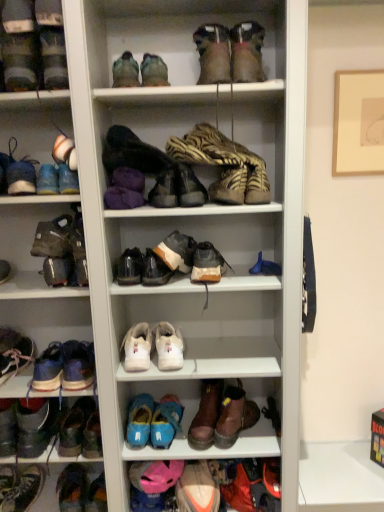
Question: Which direction should I rotate to look at brown leather boot at lower center, which is the seventh shoe from bottom to top?

Choices:
 (A) left
 (B) right

Answer: (B)

Question: Is there a large distance between leather at center, which ranks as the 10th shoe in bottom-to-top order, and white leather sneakers at center, the 8th shoe from the bottom?

Choices:
 (A) yes
 (B) no

Answer: (B)

Question: Can you confirm if leather at center, acting as the ninth shoe starting from the top, is positioned to the left of white leather sneakers at center, the 8th shoe from the bottom?

Choices:
 (A) yes
 (B) no

Answer: (B)

Question: Can we say leather at center, acting as the ninth shoe starting from the top, lies outside white leather sneakers at center, the 8th shoe from the bottom?

Choices:
 (A) yes
 (B) no

Answer: (A)

Question: Considering the relative positions of leather at center, acting as the ninth shoe starting from the top, and white leather sneakers at center, the 8th shoe from the bottom, in the image provided, is leather at center, acting as the ninth shoe starting from the top, to the right of white leather sneakers at center, the 8th shoe from the bottom, from the viewer's perspective?

Choices:
 (A) yes
 (B) no

Answer: (A)

Question: Is leather at center, which ranks as the 10th shoe in bottom-to-top order, bigger than white leather sneakers at center, positioned as the 11th shoe in top-to-bottom order?

Choices:
 (A) no
 (B) yes

Answer: (A)

Question: Considering the relative positions of leather at center, which ranks as the 10th shoe in bottom-to-top order, and white leather sneakers at center, positioned as the 11th shoe in top-to-bottom order, in the image provided, is leather at center, which ranks as the 10th shoe in bottom-to-top order, behind white leather sneakers at center, positioned as the 11th shoe in top-to-bottom order,?

Choices:
 (A) yes
 (B) no

Answer: (B)

Question: Does white matte sneaker at center, which ranks as the 10th shoe in top-to-bottom order, lie in front of multicolored fabric shoe at lower left, positioned as the second shoe in bottom-to-top order?

Choices:
 (A) no
 (B) yes

Answer: (B)

Question: Does white matte sneaker at center, the 9th shoe when ordered from bottom to top, turn towards multicolored fabric shoe at lower left, positioned as the second shoe in bottom-to-top order?

Choices:
 (A) yes
 (B) no

Answer: (B)

Question: Is white matte sneaker at center, which ranks as the 10th shoe in top-to-bottom order, thinner than multicolored fabric shoe at lower left, the 17th shoe viewed from the top?

Choices:
 (A) no
 (B) yes

Answer: (B)

Question: Considering the relative sizes of white matte sneaker at center, which ranks as the 10th shoe in top-to-bottom order, and multicolored fabric shoe at lower left, positioned as the second shoe in bottom-to-top order, in the image provided, is white matte sneaker at center, which ranks as the 10th shoe in top-to-bottom order, shorter than multicolored fabric shoe at lower left, positioned as the second shoe in bottom-to-top order,?

Choices:
 (A) yes
 (B) no

Answer: (A)

Question: Is white matte sneaker at center, which ranks as the 10th shoe in top-to-bottom order, located outside multicolored fabric shoe at lower left, the 17th shoe viewed from the top?

Choices:
 (A) no
 (B) yes

Answer: (B)

Question: Can you confirm if white matte sneaker at center, which ranks as the 10th shoe in top-to-bottom order, is taller than multicolored fabric shoe at lower left, the 17th shoe viewed from the top?

Choices:
 (A) yes
 (B) no

Answer: (B)

Question: Does leather/textured boot at center, which appears as the fifth footwear when viewed from the left, come in front of orange suede sneaker at lower center, which is the third shoe from bottom to top?

Choices:
 (A) no
 (B) yes

Answer: (B)